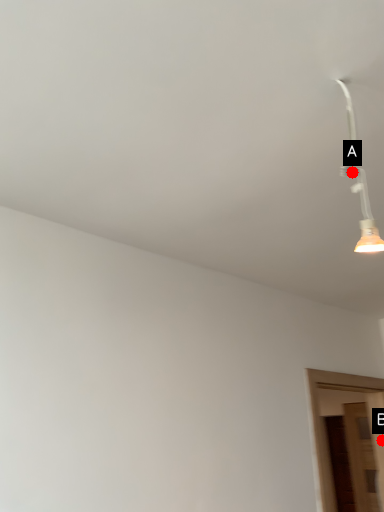
Question: Two points are circled on the image, labeled by A and B beside each circle. Which point is closer to the camera taking this photo?

Choices:
 (A) A is closer
 (B) B is closer

Answer: (A)